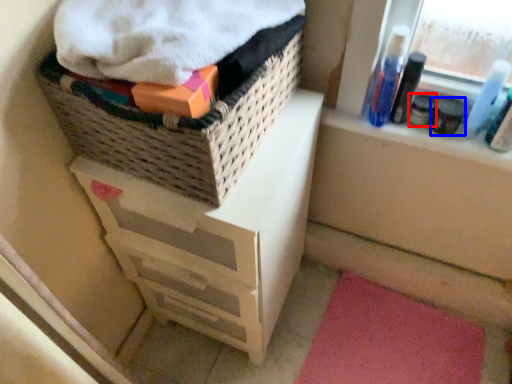
Question: Which object is closer to the camera taking this photo, toiletry (highlighted by a red box) or toiletry (highlighted by a blue box)?

Choices:
 (A) toiletry
 (B) toiletry

Answer: (B)